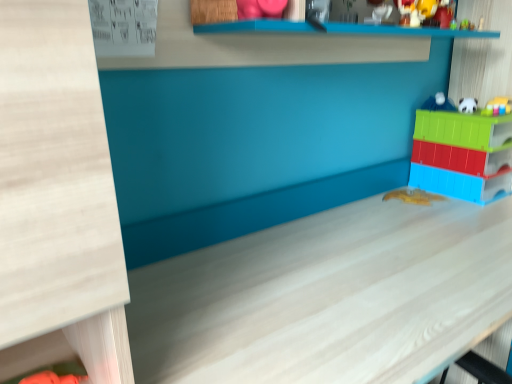
Question: From the image's perspective, is white matte table at center on green plastic toy at upper right, positioned as the third toy in bottom-to-top order?

Choices:
 (A) no
 (B) yes

Answer: (A)

Question: Would you say green plastic toy at upper right, the 3th toy positioned from the top, is part of white matte table at center's contents?

Choices:
 (A) no
 (B) yes

Answer: (A)

Question: Is white matte table at center at the right side of green plastic toy at upper right, positioned as the third toy in bottom-to-top order?

Choices:
 (A) no
 (B) yes

Answer: (A)

Question: Is the depth of white matte table at center greater than that of green plastic toy at upper right, positioned as the third toy in bottom-to-top order?

Choices:
 (A) no
 (B) yes

Answer: (A)

Question: From a real-world perspective, is white matte table at center located higher than green plastic toy at upper right, the 3th toy positioned from the top?

Choices:
 (A) yes
 (B) no

Answer: (B)

Question: Considering the relative sizes of white matte table at center and green plastic toy at upper right, the 3th toy positioned from the top, in the image provided, is white matte table at center thinner than green plastic toy at upper right, the 3th toy positioned from the top,?

Choices:
 (A) no
 (B) yes

Answer: (A)

Question: Is translucent plastic toy at right, which ranks as the 4th toy in top-to-bottom order, oriented towards white matte table at center?

Choices:
 (A) yes
 (B) no

Answer: (B)

Question: Is translucent plastic toy at right, the second toy from the bottom, looking in the opposite direction of white matte table at center?

Choices:
 (A) no
 (B) yes

Answer: (A)

Question: Considering the relative sizes of translucent plastic toy at right, the second toy from the bottom, and white matte table at center in the image provided, is translucent plastic toy at right, the second toy from the bottom, shorter than white matte table at center?

Choices:
 (A) yes
 (B) no

Answer: (A)

Question: Considering the relative positions of translucent plastic toy at right, the second toy from the bottom, and white matte table at center in the image provided, is translucent plastic toy at right, the second toy from the bottom, behind white matte table at center?

Choices:
 (A) no
 (B) yes

Answer: (B)

Question: From a real-world perspective, is translucent plastic toy at right, the second toy from the bottom, beneath white matte table at center?

Choices:
 (A) yes
 (B) no

Answer: (B)

Question: Considering the relative sizes of translucent plastic toy at right, the second toy from the bottom, and white matte table at center in the image provided, is translucent plastic toy at right, the second toy from the bottom, bigger than white matte table at center?

Choices:
 (A) yes
 (B) no

Answer: (B)

Question: Can you confirm if green plastic toy at upper right, the 3th toy positioned from the top, is shorter than translucent plastic toy at right, the second toy from the bottom?

Choices:
 (A) no
 (B) yes

Answer: (B)